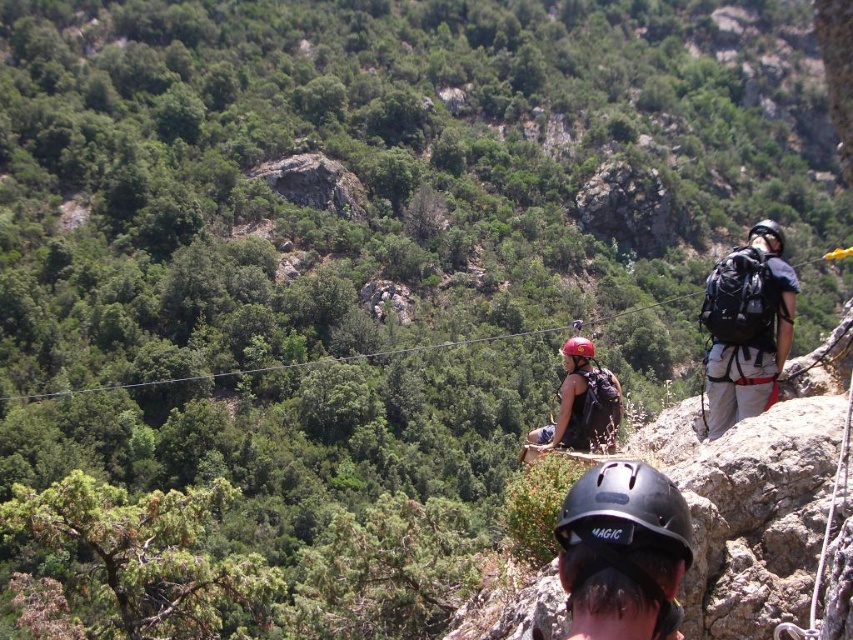
Looking at this image, you are a safety officer at the climbing site. You need to ensure that the safety ropes are long enough to reach the point at coordinates point (753,349). The ropes you have are 20 meters long. Can the ropes reach that point?

The point (753,349) is 20.87 meters from camera, so the ropes are 20 meters long, which is shorter than the required distance. Therefore, the ropes cannot reach that point.